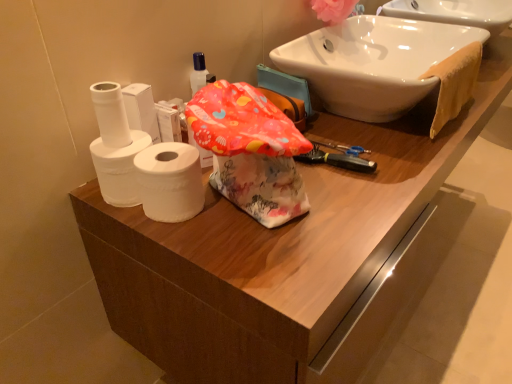
Locate an element on the screen. This screenshot has width=512, height=384. vacant area located to the right-hand side of white matte toilet paper at left, positioned as the first toilet paper in right-to-left order is located at coordinates (262, 222).